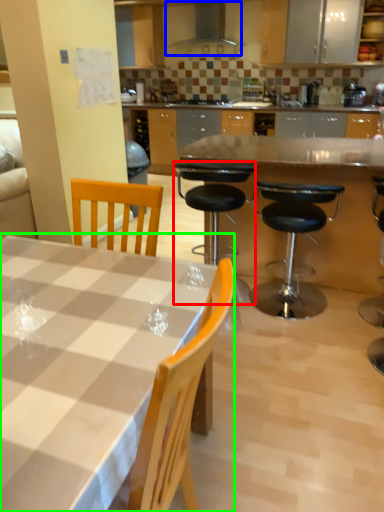
Question: Considering the real-world distances, which object is farthest from chair (highlighted by a red box)? exhaust hood (highlighted by a blue box) or kitchen & dining room table (highlighted by a green box)?

Choices:
 (A) exhaust hood
 (B) kitchen & dining room table

Answer: (A)